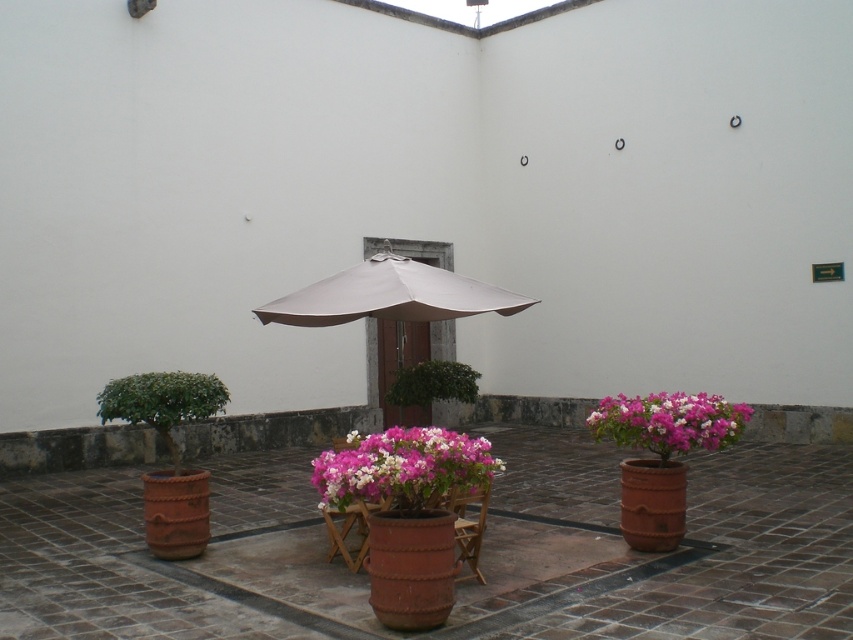
Question: Does beige fabric umbrella at center have a lesser width compared to pink matte flower pot at right?

Choices:
 (A) yes
 (B) no

Answer: (B)

Question: Does pink matte flowers at center have a lesser width compared to pink matte flower pot at right?

Choices:
 (A) yes
 (B) no

Answer: (B)

Question: Is beige fabric umbrella at center positioned at the back of pink matte flower pot at right?

Choices:
 (A) yes
 (B) no

Answer: (B)

Question: Which object appears farthest from the camera in this image?

Choices:
 (A) pink matte flowers at center
 (B) beige fabric umbrella at center
 (C) pink matte flower pot at right

Answer: (C)

Question: Among these objects, which one is farthest from the camera?

Choices:
 (A) beige fabric umbrella at center
 (B) pink matte flower pot at right
 (C) pink matte flowers at center

Answer: (B)

Question: Which point is farther to the camera?

Choices:
 (A) (698, 406)
 (B) (437, 268)
 (C) (430, 433)

Answer: (B)